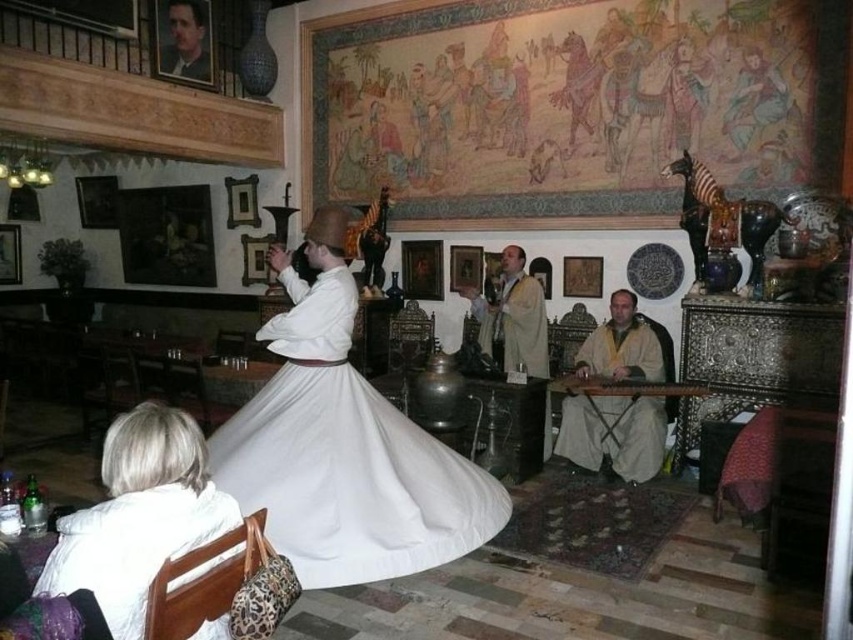
Identify the location of white cotton dress at center. (345, 458).

Who is taller, white cotton dress at center or white fabric at lower left?

white cotton dress at center

Does point (386, 426) come behind point (219, 497)?

Yes, point (386, 426) is farther from viewer.

I want to click on white cotton dress at center, so click(x=345, y=458).

Does beige woolen robe at right have a lesser height compared to white clothed figure at center?

In fact, beige woolen robe at right may be taller than white clothed figure at center.

Who is lower down, beige woolen robe at right or white clothed figure at center?

Positioned lower is beige woolen robe at right.

The image size is (853, 640). What do you see at coordinates (613, 435) in the screenshot? I see `beige woolen robe at right` at bounding box center [613, 435].

Locate an element on the screen. beige woolen robe at right is located at coordinates (613, 435).

Between white cotton dress at center and white clothed figure at center, which one is positioned lower?

white cotton dress at center is below.

Which is behind, point (270, 444) or point (543, 323)?

Positioned behind is point (543, 323).

Image resolution: width=853 pixels, height=640 pixels. Find the location of `white cotton dress at center`. white cotton dress at center is located at coordinates (345, 458).

The height and width of the screenshot is (640, 853). I want to click on white cotton dress at center, so click(x=345, y=458).